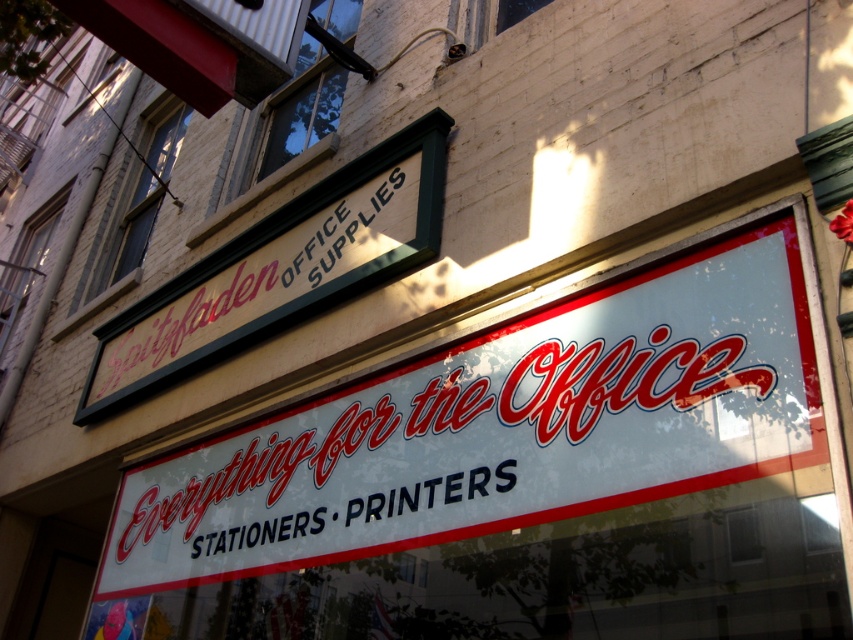
Who is more forward, (x=280, y=285) or (x=503, y=468)?

Positioned in front is point (x=503, y=468).

Between point (234, 317) and point (354, 538), which one is positioned behind?

The point (234, 317) is more distant.

This screenshot has width=853, height=640. What are the coordinates of `matte green signboard at upper left` in the screenshot? It's located at (280, 268).

Which is above, white plastic sign at center or white matte signboard at center?

white plastic sign at center

Between point (375, 516) and point (264, 538), which one is positioned in front?

Positioned in front is point (375, 516).

Is point (137, 522) in front of point (200, 544)?

No, it is behind (200, 544).

You are a GUI agent. You are given a task and a screenshot of the screen. Output one action in this format:
    pyautogui.click(x=<x>, y=<y>)
    Task: Click on the white plastic sign at center
    This screenshot has width=853, height=640.
    Given the screenshot: What is the action you would take?
    pyautogui.click(x=457, y=448)

Based on the photo, which is above, white plastic sign at center or matte green signboard at upper left?

matte green signboard at upper left is above.

Which is more to the left, white plastic sign at center or matte green signboard at upper left?

Positioned to the left is matte green signboard at upper left.

The image size is (853, 640). Identify the location of white plastic sign at center. (457, 448).